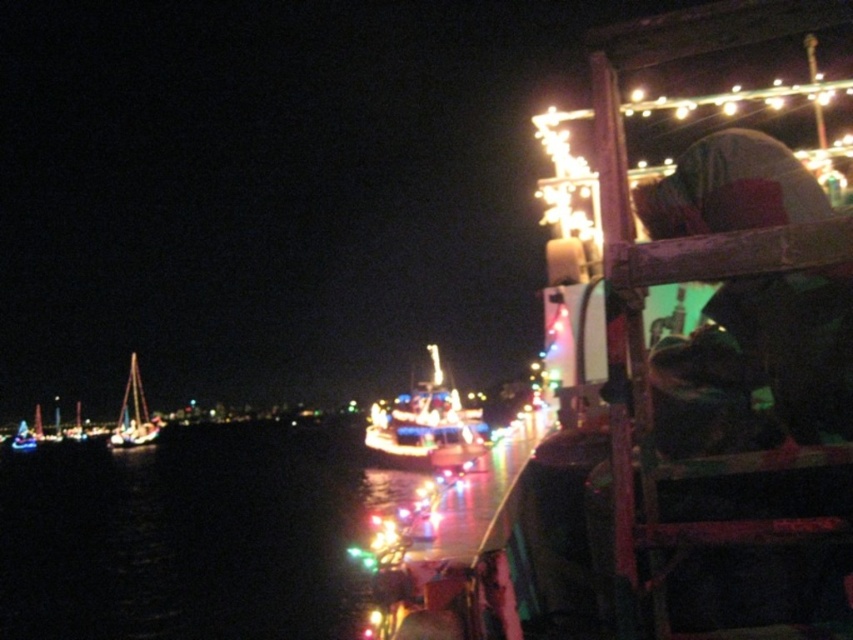
Does shiny silver sailboat at left have a lesser height compared to shiny white sailboat at left?

In fact, shiny silver sailboat at left may be taller than shiny white sailboat at left.

Who is taller, shiny silver sailboat at left or shiny white sailboat at left?

shiny silver sailboat at left is taller.

Between point (119, 420) and point (16, 442), which one is positioned behind?

The point (16, 442) is more distant.

Where is `shiny silver sailboat at left`? Image resolution: width=853 pixels, height=640 pixels. shiny silver sailboat at left is located at coordinates (132, 413).

Measure the distance from black water at center to shiny silver sailboat at left.

black water at center is 87.26 feet from shiny silver sailboat at left.

Is black water at center positioned in front of shiny silver sailboat at left?

Yes, black water at center is in front of shiny silver sailboat at left.

The height and width of the screenshot is (640, 853). Find the location of `black water at center`. black water at center is located at coordinates (186, 536).

Who is shorter, black water at center or shiny white sailboat at left?

Standing shorter between the two is shiny white sailboat at left.

This screenshot has height=640, width=853. What do you see at coordinates (186, 536) in the screenshot?
I see `black water at center` at bounding box center [186, 536].

This screenshot has width=853, height=640. I want to click on black water at center, so click(x=186, y=536).